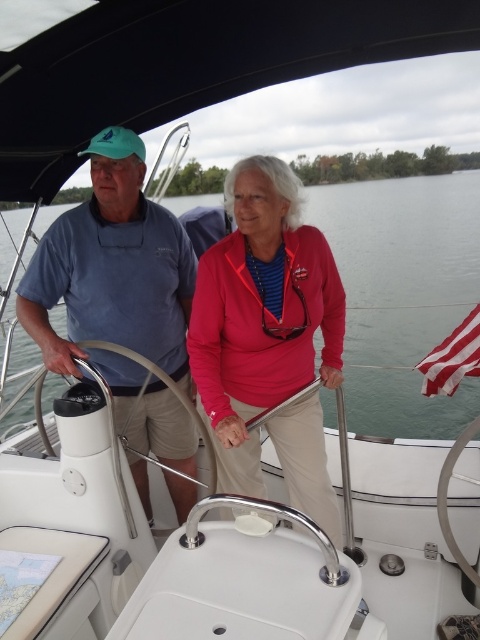
Which is behind, point (43, 324) or point (464, 364)?

Positioned behind is point (464, 364).

Is matte blue shirt at center wider than striped fabric flag at right?

Yes, matte blue shirt at center is wider than striped fabric flag at right.

Which is in front, point (191, 445) or point (429, 374)?

Positioned in front is point (429, 374).

Find the location of `matte blue shirt at center`. matte blue shirt at center is located at coordinates (120, 294).

Is matte red jacket at center smaller than striped fabric flag at right?

No, matte red jacket at center is not smaller than striped fabric flag at right.

Is matte red jacket at center positioned in front of striped fabric flag at right?

Yes, it is.

Does point (255, 380) lie in front of point (478, 307)?

Yes, it is.

Identify the location of matte red jacket at center. The height and width of the screenshot is (640, 480). (261, 314).

Which is more to the right, clear water at center or striped fabric flag at right?

From the viewer's perspective, striped fabric flag at right appears more on the right side.

Describe the element at coordinates (403, 292) in the screenshot. This screenshot has width=480, height=640. I see `clear water at center` at that location.

The height and width of the screenshot is (640, 480). I want to click on clear water at center, so (x=403, y=292).